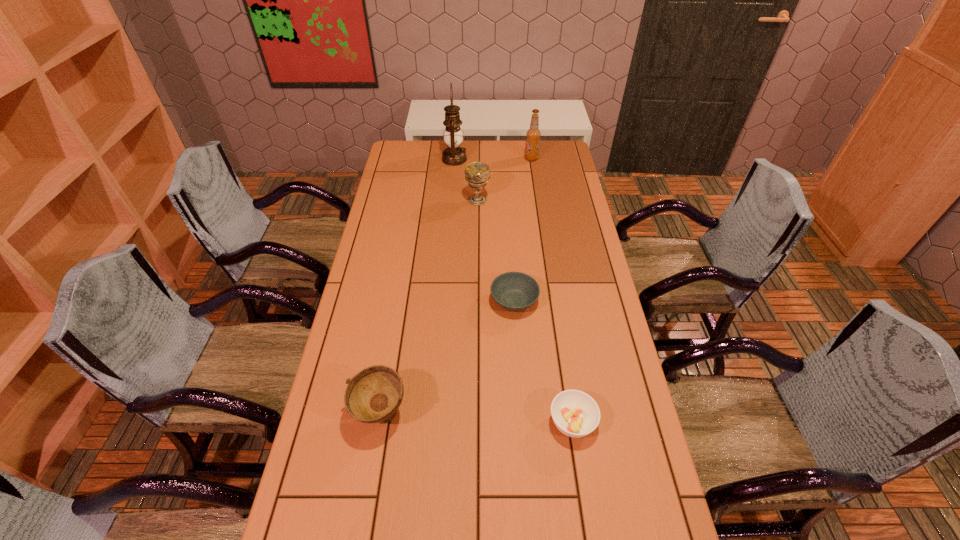
Where is `the tallest object`? the tallest object is located at coordinates (454, 155).

Identify the location of the fifth shortest object. The height and width of the screenshot is (540, 960). (533, 134).

Identify the location of chalice. (477, 174).

Locate an element on the screen. The height and width of the screenshot is (540, 960). the third tallest object is located at coordinates [x=477, y=174].

Identify the location of the leftmost object. (374, 394).

Identify the location of the tallest soup bowl. (374, 394).

Image resolution: width=960 pixels, height=540 pixels. Identify the location of the farthest soup bowl. (514, 291).

Identify the location of free space located on the front of the tallest object. (450, 208).

Identify the location of vacant space positioned on the front label of the fifth shortest object. (510, 158).

You are a GUI agent. You are given a task and a screenshot of the screen. Output one action in this format:
    pyautogui.click(x=<x>, y=<y>)
    Task: Click on the free region located on the front label of the fifth shortest object
    The width and height of the screenshot is (960, 540).
    Given the screenshot: What is the action you would take?
    pyautogui.click(x=478, y=158)